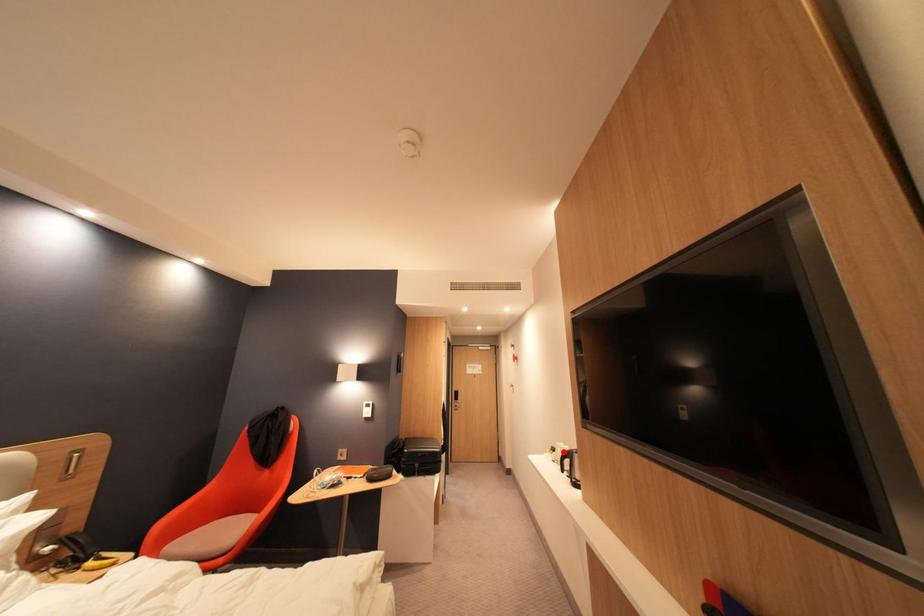
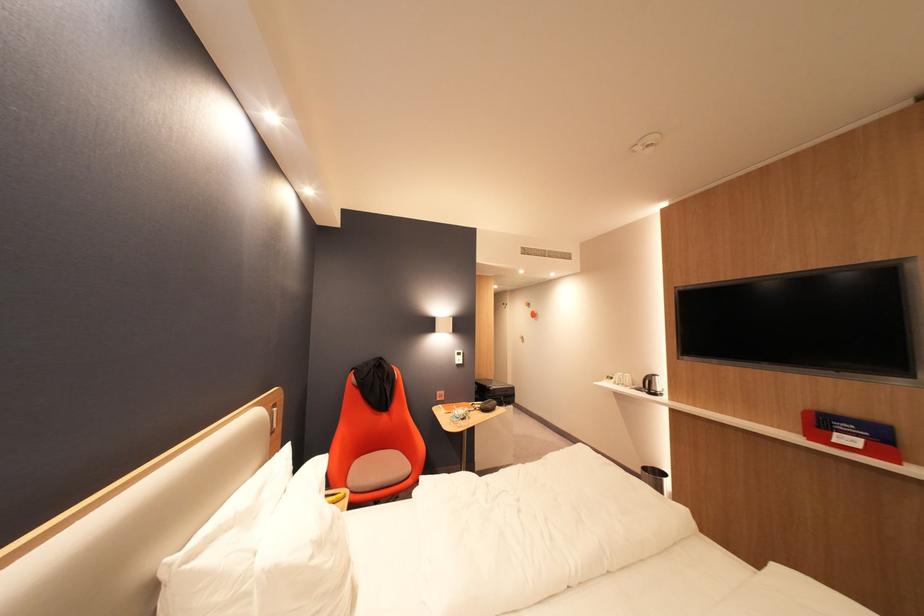
Find the pixel in the second image that matches the highlighted location in the first image.

(622, 379)